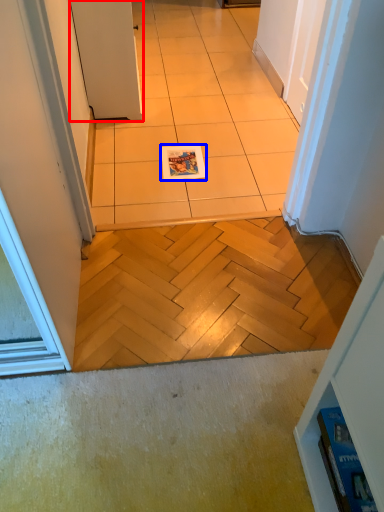
Question: Which point is further to the camera, door (highlighted by a red box) or magazine (highlighted by a blue box)?

Choices:
 (A) door
 (B) magazine

Answer: (B)